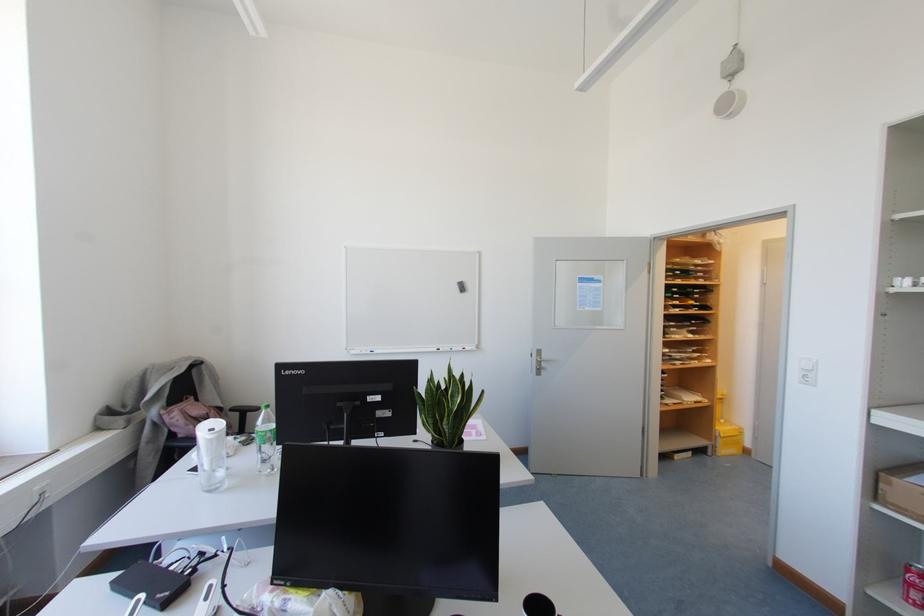
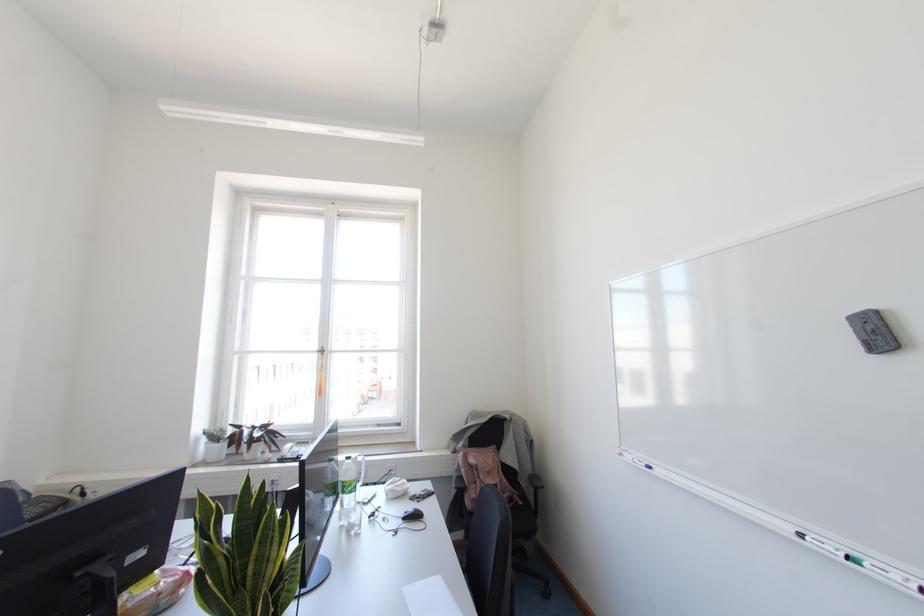
Find the pixel in the second image that matches (x=438, y=349) in the first image.

(800, 536)